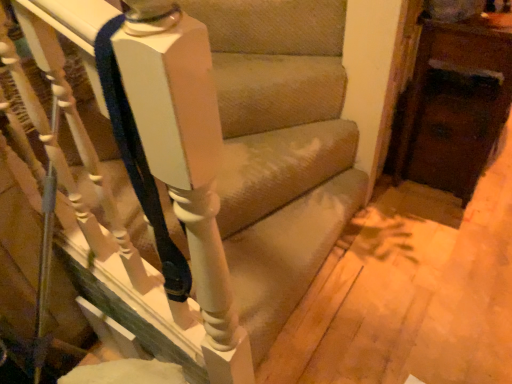
Image resolution: width=512 pixels, height=384 pixels. What do you see at coordinates (454, 106) in the screenshot?
I see `dark brown wood dresser at right` at bounding box center [454, 106].

What is the approximate width of dark brown wood dresser at right?

dark brown wood dresser at right is 16.03 inches in width.

Identify the location of dark brown wood dresser at right. The width and height of the screenshot is (512, 384). (454, 106).

Identify the location of dark brown wood dresser at right. The image size is (512, 384). (454, 106).